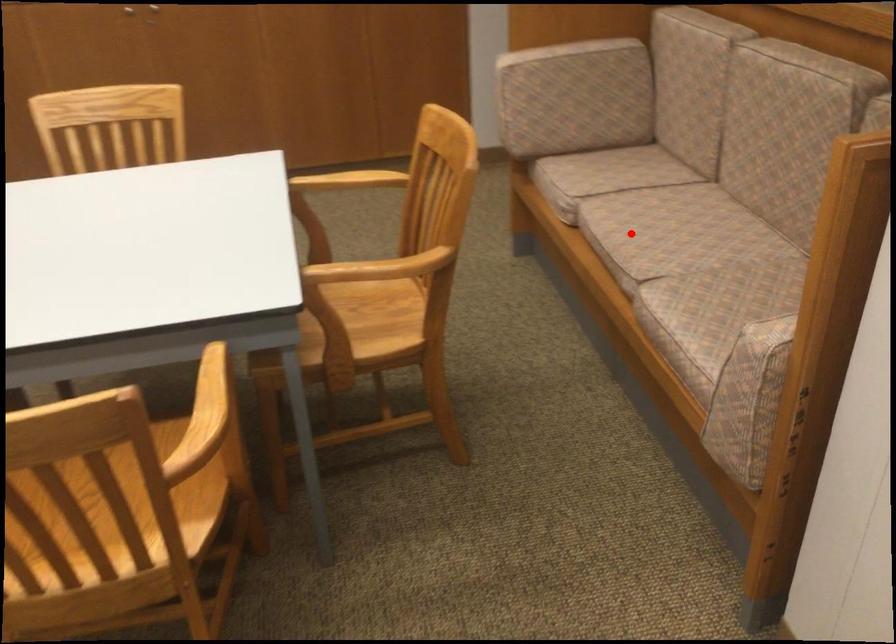
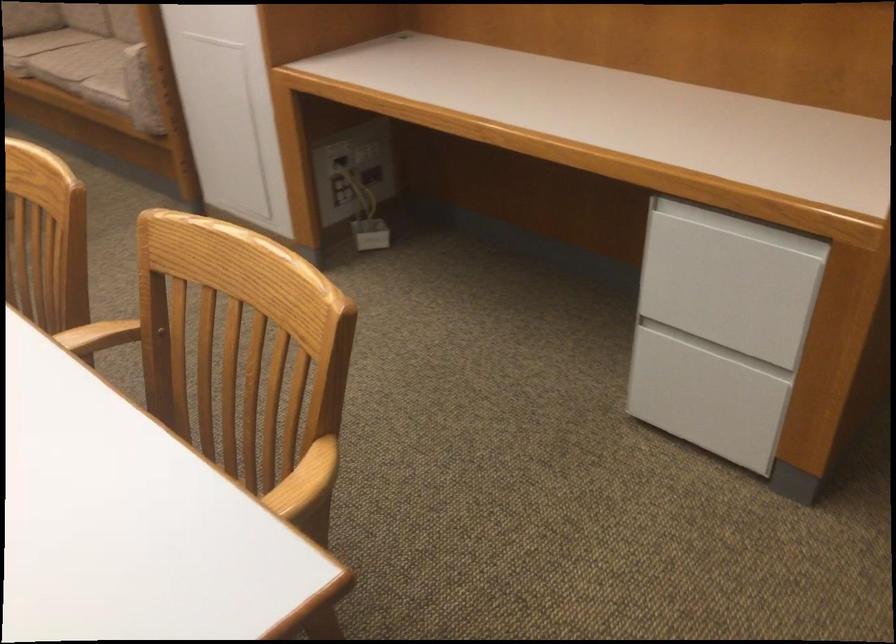
Question: I am providing you with two images of the same scene from different viewpoints. A red point is marked on the first image. At the location where the point appears in image 1, is it still visible in image 2?

Choices:
 (A) Yes
 (B) No

Answer: (A)